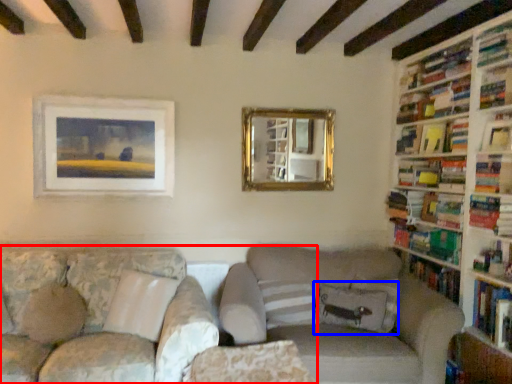
Question: Which point is further to the camera, studio couch (highlighted by a red box) or pillow (highlighted by a blue box)?

Choices:
 (A) studio couch
 (B) pillow

Answer: (B)